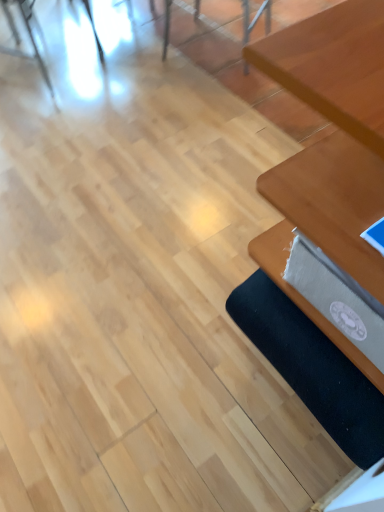
Question: Does wooden table at right have a greater height compared to black fabric yoga mat at lower right?

Choices:
 (A) no
 (B) yes

Answer: (B)

Question: Does wooden table at right have a larger size compared to black fabric yoga mat at lower right?

Choices:
 (A) no
 (B) yes

Answer: (B)

Question: Does wooden table at right lie in front of black fabric yoga mat at lower right?

Choices:
 (A) yes
 (B) no

Answer: (A)

Question: Does wooden table at right come behind black fabric yoga mat at lower right?

Choices:
 (A) yes
 (B) no

Answer: (B)

Question: Is wooden table at right not within black fabric yoga mat at lower right?

Choices:
 (A) no
 (B) yes

Answer: (B)

Question: Can you confirm if wooden table at right is smaller than black fabric yoga mat at lower right?

Choices:
 (A) no
 (B) yes

Answer: (A)

Question: Is wooden table at right oriented towards wooden chair at upper center, which ranks as the first chair in right-to-left order?

Choices:
 (A) no
 (B) yes

Answer: (B)

Question: Can you confirm if wooden table at right is bigger than wooden chair at upper center, which ranks as the first chair in right-to-left order?

Choices:
 (A) no
 (B) yes

Answer: (B)

Question: Is wooden chair at upper center, which ranks as the first chair in right-to-left order, located within wooden table at right?

Choices:
 (A) no
 (B) yes

Answer: (A)

Question: Are wooden table at right and wooden chair at upper center, which is counted as the 2th chair, starting from the left, far apart?

Choices:
 (A) yes
 (B) no

Answer: (A)

Question: Is wooden table at right at the left side of wooden chair at upper center, which is counted as the 2th chair, starting from the left?

Choices:
 (A) no
 (B) yes

Answer: (A)

Question: Does wooden table at right have a smaller size compared to wooden chair at upper center, which ranks as the first chair in right-to-left order?

Choices:
 (A) yes
 (B) no

Answer: (B)

Question: From a real-world perspective, is wooden chair at upper center, which is counted as the 2th chair, starting from the left, on top of metallic silver chair at upper left, which is the second chair from right to left?

Choices:
 (A) yes
 (B) no

Answer: (B)